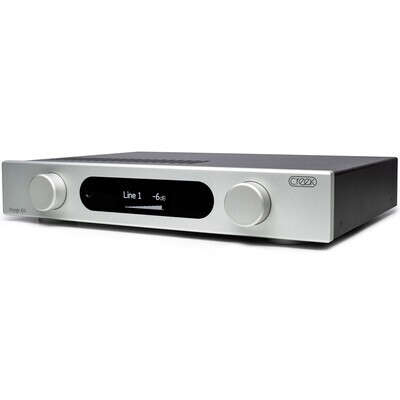
Where is `amplifier`? amplifier is located at coordinates [313, 225].